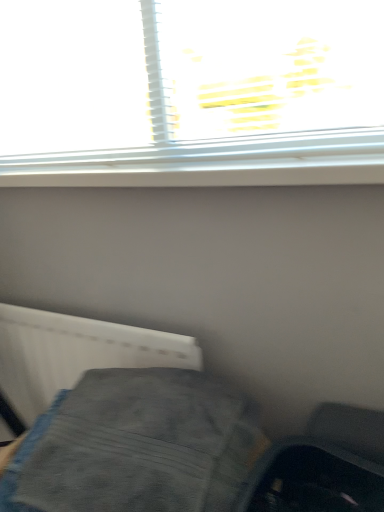
Question: From the image's perspective, is white plastic radiator at lower left over gray fabric at lower left?

Choices:
 (A) no
 (B) yes

Answer: (B)

Question: From a real-world perspective, is white plastic radiator at lower left over gray fabric at lower left?

Choices:
 (A) yes
 (B) no

Answer: (B)

Question: Does white plastic radiator at lower left appear on the left side of gray fabric at lower left?

Choices:
 (A) yes
 (B) no

Answer: (A)

Question: Can you confirm if white plastic radiator at lower left is positioned to the right of gray fabric at lower left?

Choices:
 (A) no
 (B) yes

Answer: (A)

Question: From the image's perspective, is white plastic radiator at lower left beneath gray fabric at lower left?

Choices:
 (A) no
 (B) yes

Answer: (A)

Question: Is white plastic radiator at lower left thinner than gray fabric at lower left?

Choices:
 (A) yes
 (B) no

Answer: (A)

Question: Are gray fabric at lower left and white plastic radiator at lower left beside each other?

Choices:
 (A) no
 (B) yes

Answer: (A)

Question: Considering the relative sizes of gray fabric at lower left and white plastic radiator at lower left in the image provided, is gray fabric at lower left thinner than white plastic radiator at lower left?

Choices:
 (A) no
 (B) yes

Answer: (A)

Question: Does gray fabric at lower left have a greater width compared to white plastic radiator at lower left?

Choices:
 (A) no
 (B) yes

Answer: (B)

Question: From a real-world perspective, is gray fabric at lower left over white plastic radiator at lower left?

Choices:
 (A) no
 (B) yes

Answer: (B)

Question: From the image's perspective, would you say gray fabric at lower left is positioned over white plastic radiator at lower left?

Choices:
 (A) no
 (B) yes

Answer: (A)

Question: Would you consider gray fabric at lower left to be distant from white plastic radiator at lower left?

Choices:
 (A) no
 (B) yes

Answer: (A)

Question: Is gray fabric at lower left inside the boundaries of white plastic radiator at lower left, or outside?

Choices:
 (A) outside
 (B) inside

Answer: (A)